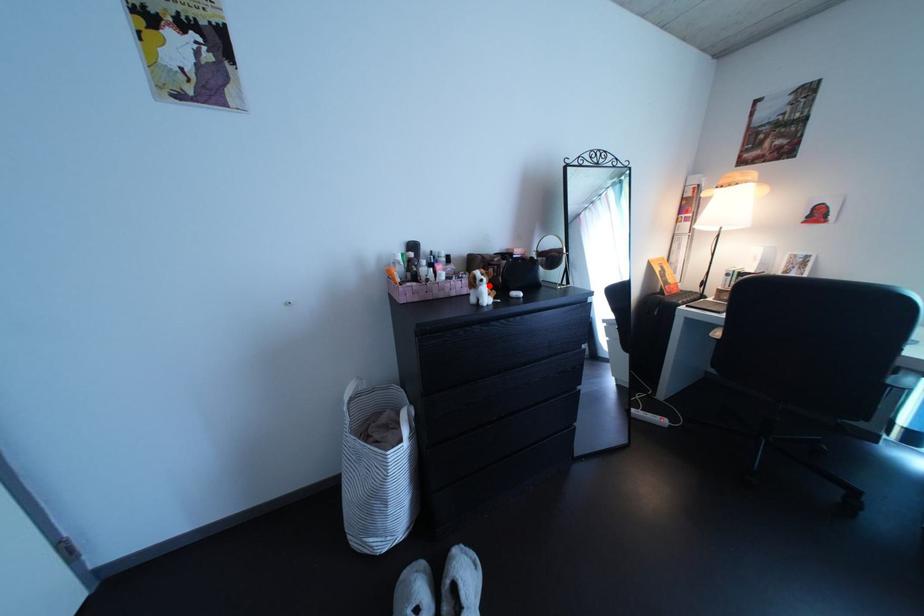
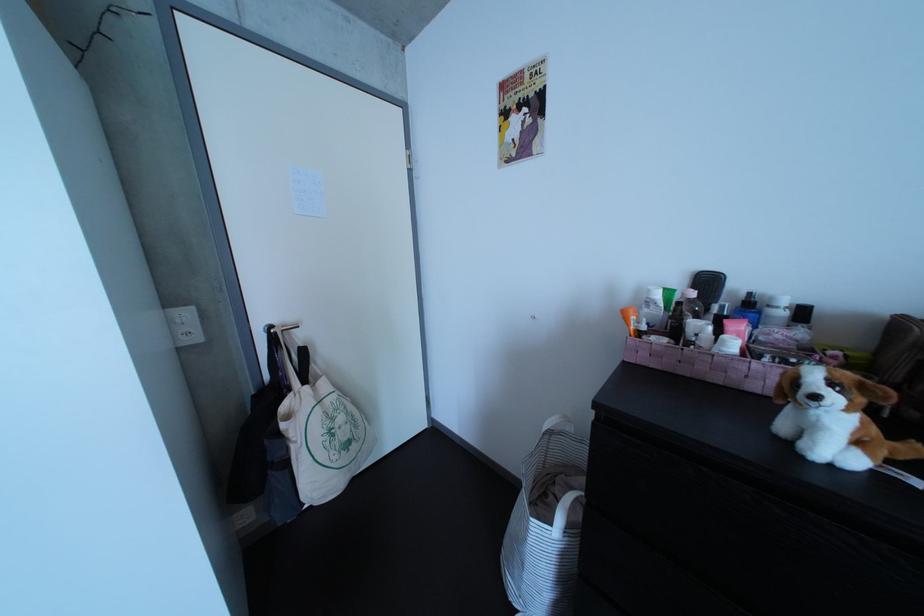
In the second image, find the point that corresponds to the highlighted location in the first image.

(809, 389)